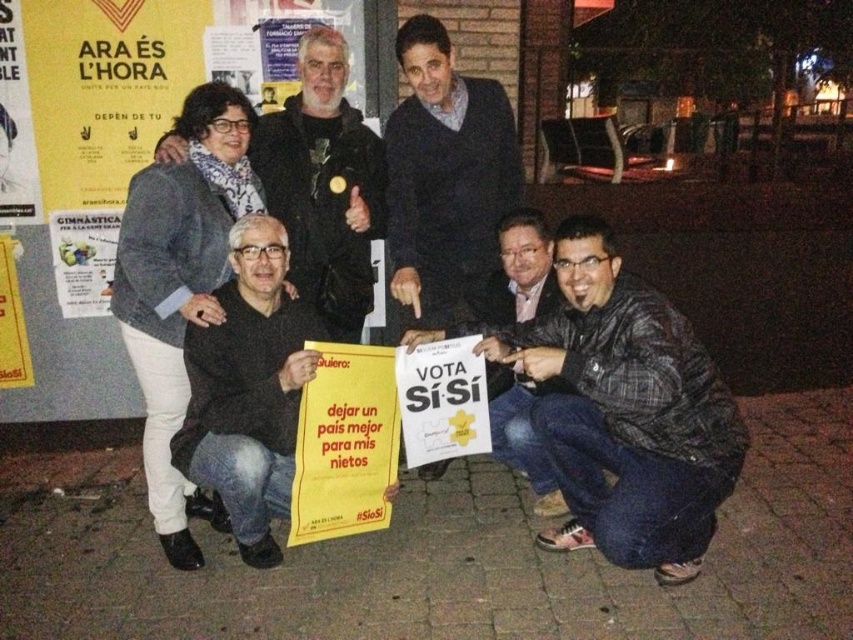
Between point (22, 148) and point (305, 216), which one is positioned behind?

The point (22, 148) is more distant.

Is yellow paper poster at upper left shorter than matte black jacket at upper left?

Incorrect, yellow paper poster at upper left's height does not fall short of matte black jacket at upper left's.

You are a GUI agent. You are given a task and a screenshot of the screen. Output one action in this format:
    pyautogui.click(x=<x>, y=<y>)
    Task: Click on the yellow paper poster at upper left
    The width and height of the screenshot is (853, 640).
    Given the screenshot: What is the action you would take?
    pyautogui.click(x=106, y=152)

Is black matte sign at lower left further to camera compared to white paper sign at lower center?

No, black matte sign at lower left is closer to the viewer.

Looking at this image, between black matte sign at lower left and white paper sign at lower center, which one has less height?

white paper sign at lower center is shorter.

Which is behind, point (280, 413) or point (453, 336)?

The point (453, 336) is behind.

The width and height of the screenshot is (853, 640). Identify the location of black matte sign at lower left. (248, 390).

Does point (432, 60) lie behind point (335, 243)?

That is False.

Which is in front, point (426, 61) or point (349, 212)?

Positioned in front is point (426, 61).

Is point (450, 141) less distant than point (300, 259)?

No, (450, 141) is further to viewer.

Where is `dark blue sweater at center`? This screenshot has width=853, height=640. dark blue sweater at center is located at coordinates (445, 177).